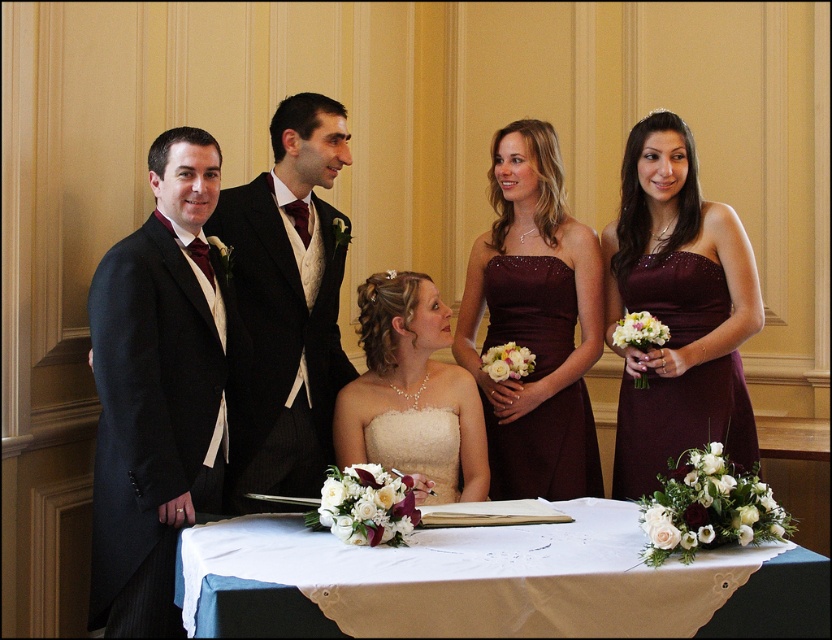
You are a photographer at the wedding signing ceremony. You want to ensure both the shiny black suit at center and the white satin dress at center are clearly visible in the photo. Given their sizes, which one might require more space in the frame to capture fully?

The shiny black suit at center has a larger size compared to the white satin dress at center, so it would require more space in the frame to ensure it is fully captured.

You are a photographer at the wedding signing ceremony. You want to capture a photo that includes both the matte black suit at left and the shiny black suit at center. Based on their positions, which one should you focus on first to ensure both are in the frame?

The matte black suit at left is located below the shiny black suit at center. To capture both in the frame, focus on the shiny black suit at center first as it is higher up, allowing the camera to include the lower positioned matte black suit at left in the shot.